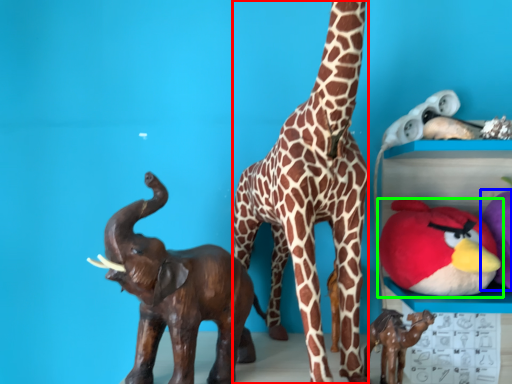
Question: Which object is the farthest from giraffe (highlighted by a red box)? Choose among these: toy (highlighted by a blue box) or toy (highlighted by a green box).

Choices:
 (A) toy
 (B) toy

Answer: (A)